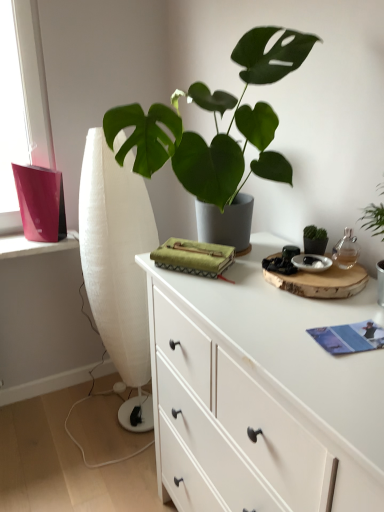
I want to click on free point above white matte chest of drawers at center (from a real-world perspective), so click(x=268, y=292).